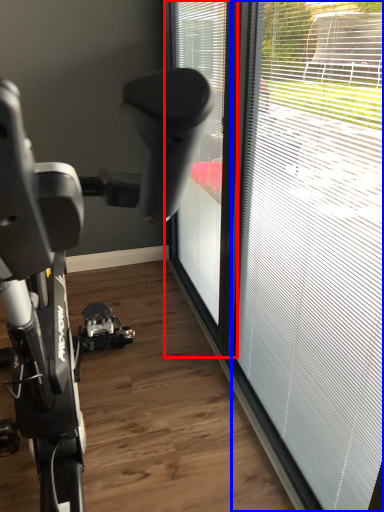
Question: Which object appears farthest to the camera in this image, window (highlighted by a red box) or window (highlighted by a blue box)?

Choices:
 (A) window
 (B) window

Answer: (A)